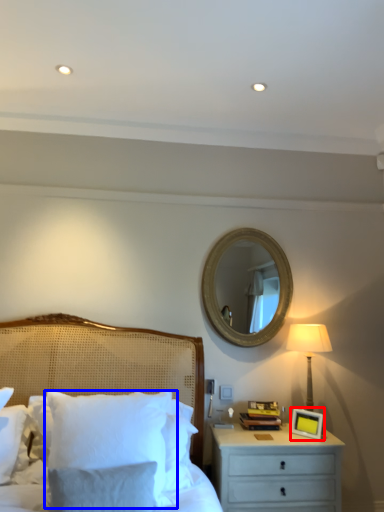
Question: Which object is further to the camera taking this photo, picture frame (highlighted by a red box) or pillow (highlighted by a blue box)?

Choices:
 (A) picture frame
 (B) pillow

Answer: (A)